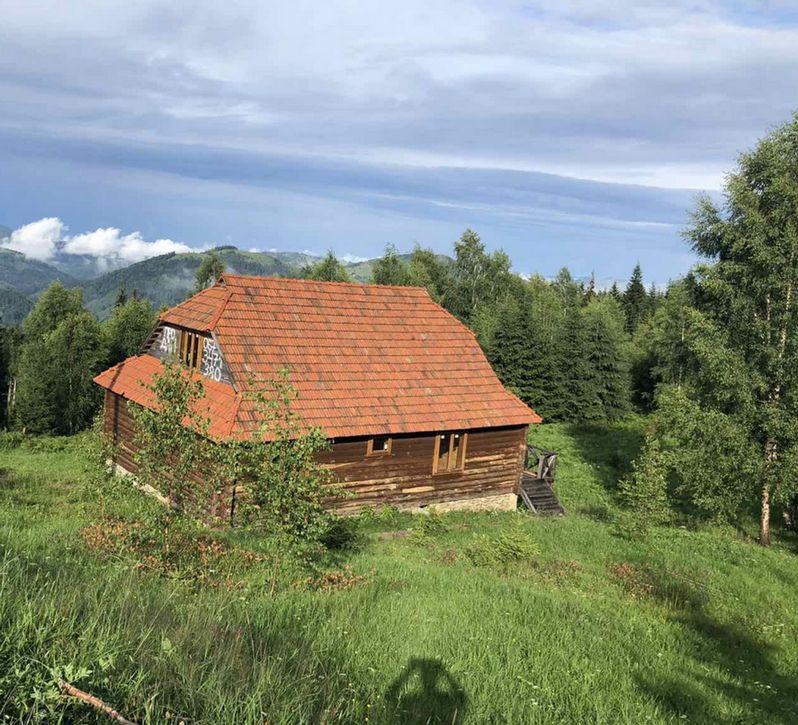
Find the location of a particular element. The image size is (798, 725). window is located at coordinates (449, 452).